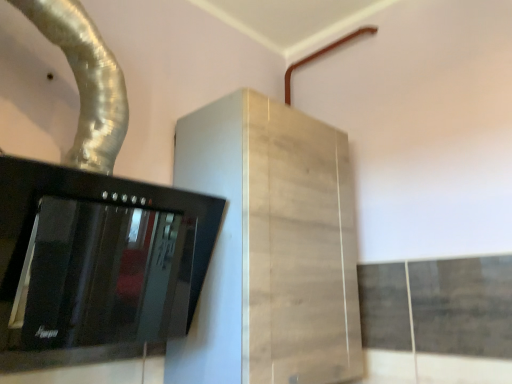
Question: Is brown matte pipe at upper right further to the viewer compared to light wood cabinet at center?

Choices:
 (A) yes
 (B) no

Answer: (A)

Question: Considering the relative sizes of brown matte pipe at upper right and light wood cabinet at center in the image provided, is brown matte pipe at upper right shorter than light wood cabinet at center?

Choices:
 (A) no
 (B) yes

Answer: (B)

Question: Is brown matte pipe at upper right thinner than light wood cabinet at center?

Choices:
 (A) yes
 (B) no

Answer: (A)

Question: Is the position of brown matte pipe at upper right less distant than that of light wood cabinet at center?

Choices:
 (A) no
 (B) yes

Answer: (A)

Question: Would you say brown matte pipe at upper right contains light wood cabinet at center?

Choices:
 (A) yes
 (B) no

Answer: (B)

Question: Is brown matte pipe at upper right to the right of light wood cabinet at center from the viewer's perspective?

Choices:
 (A) yes
 (B) no

Answer: (A)

Question: From the image's perspective, would you say silver metallic duct at upper left is shown under light wood cabinet at center?

Choices:
 (A) yes
 (B) no

Answer: (B)

Question: Are silver metallic duct at upper left and light wood cabinet at center far apart?

Choices:
 (A) no
 (B) yes

Answer: (A)

Question: Is silver metallic duct at upper left aimed at light wood cabinet at center?

Choices:
 (A) yes
 (B) no

Answer: (B)

Question: Considering the relative sizes of silver metallic duct at upper left and light wood cabinet at center in the image provided, is silver metallic duct at upper left bigger than light wood cabinet at center?

Choices:
 (A) no
 (B) yes

Answer: (A)

Question: Is silver metallic duct at upper left smaller than light wood cabinet at center?

Choices:
 (A) yes
 (B) no

Answer: (A)

Question: Is silver metallic duct at upper left to the right of light wood cabinet at center from the viewer's perspective?

Choices:
 (A) yes
 (B) no

Answer: (B)

Question: Does silver metallic duct at upper left appear on the right side of black glass stove at left?

Choices:
 (A) no
 (B) yes

Answer: (A)